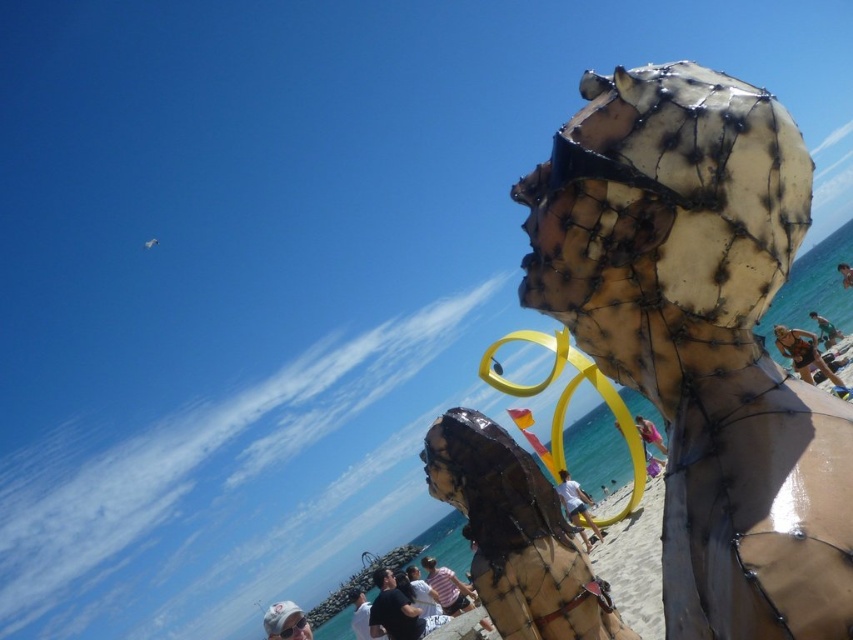
Question: From the image, what is the correct spatial relationship of blue fabric swimsuit at lower right in relation to smooth brown skin at upper right?

Choices:
 (A) right
 (B) left

Answer: (B)

Question: Can you confirm if striped cotton shirt at center is positioned to the left of white fabric shirt at lower center?

Choices:
 (A) yes
 (B) no

Answer: (B)

Question: Which of the following is the closest to the observer?

Choices:
 (A) (844, 262)
 (B) (368, 612)

Answer: (B)

Question: Which point appears closest to the camera in this image?

Choices:
 (A) (566, 481)
 (B) (848, 284)
 (C) (280, 611)

Answer: (C)

Question: Observing the image, what is the correct spatial positioning of rusty metal sculpture at center in reference to smooth brown skin at upper right?

Choices:
 (A) left
 (B) right

Answer: (A)

Question: Among these points, which one is nearest to the camera?

Choices:
 (A) (659, 385)
 (B) (462, 596)

Answer: (A)